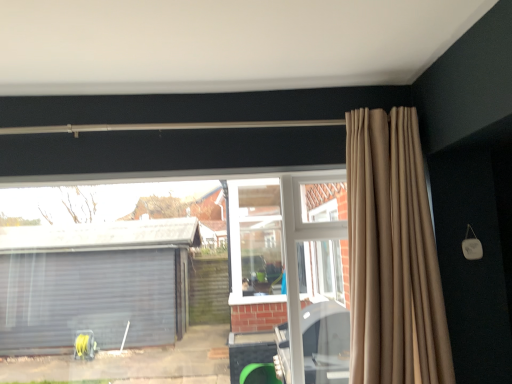
This screenshot has height=384, width=512. In order to click on transparent glass window at center in this screenshot , I will do `click(101, 283)`.

Image resolution: width=512 pixels, height=384 pixels. What do you see at coordinates (101, 283) in the screenshot? I see `transparent glass window at center` at bounding box center [101, 283].

In order to face transparent glass window at center, should I rotate leftwards or rightwards?

To face it directly, rotate left by 10.514 degrees.

In order to face beige fabric curtain at upper right, should I rotate leftwards or rightwards?

Rotate right and turn 17.223 degrees.

The width and height of the screenshot is (512, 384). What do you see at coordinates (393, 255) in the screenshot? I see `beige fabric curtain at upper right` at bounding box center [393, 255].

In order to click on beige fabric curtain at upper right in this screenshot , I will do `click(393, 255)`.

The height and width of the screenshot is (384, 512). Find the location of `transparent glass window at center`. transparent glass window at center is located at coordinates (101, 283).

Can you confirm if transparent glass window at center is positioned to the left of beige fabric curtain at upper right?

Indeed, transparent glass window at center is positioned on the left side of beige fabric curtain at upper right.

Which object is closer to the camera taking this photo, transparent glass window at center or beige fabric curtain at upper right?

beige fabric curtain at upper right is more forward.

Is point (71, 309) closer or farther from the camera than point (428, 265)?

Point (71, 309) is farther from the camera than point (428, 265).

From the image's perspective, is transparent glass window at center positioned above or below beige fabric curtain at upper right?

Based on their image positions, transparent glass window at center is located beneath beige fabric curtain at upper right.

From a real-world perspective, is transparent glass window at center over beige fabric curtain at upper right?

No, from a real-world perspective, transparent glass window at center is not over beige fabric curtain at upper right

Does transparent glass window at center have a greater width compared to beige fabric curtain at upper right?

No.

Does transparent glass window at center have a lesser height compared to beige fabric curtain at upper right?

Yes.

Which of these two, transparent glass window at center or beige fabric curtain at upper right, is bigger?

beige fabric curtain at upper right.

Is transparent glass window at center inside or outside of beige fabric curtain at upper right?

transparent glass window at center exists outside the volume of beige fabric curtain at upper right.

Is transparent glass window at center not near beige fabric curtain at upper right?

That's right, there is a large distance between transparent glass window at center and beige fabric curtain at upper right.

Based on the photo, is transparent glass window at center looking in the opposite direction of beige fabric curtain at upper right?

transparent glass window at center is not turned away from beige fabric curtain at upper right.

How distant is transparent glass window at center from beige fabric curtain at upper right?

The distance of transparent glass window at center from beige fabric curtain at upper right is 3.02 meters.

At what (x,y) coordinates should I click in order to perform the action: click on curtain above the transparent glass window at center (from a real-world perspective). Please return your answer as a coordinate pair (x, y). The height and width of the screenshot is (384, 512). Looking at the image, I should click on (393, 255).

Considering the relative positions of beige fabric curtain at upper right and transparent glass window at center in the image provided, is beige fabric curtain at upper right to the right of transparent glass window at center from the viewer's perspective?

Yes, beige fabric curtain at upper right is to the right of transparent glass window at center.

Which object is closer to the camera taking this photo, beige fabric curtain at upper right or transparent glass window at center?

beige fabric curtain at upper right is closer to the camera.

Is point (371, 221) farther from camera compared to point (295, 231)?

No, (371, 221) is in front of (295, 231).

From the image's perspective, is beige fabric curtain at upper right located above or below transparent glass window at center?

From the image's perspective, beige fabric curtain at upper right appears above transparent glass window at center.

From a real-world perspective, which is physically below, beige fabric curtain at upper right or transparent glass window at center?

transparent glass window at center.

From the picture: Can you confirm if beige fabric curtain at upper right is thinner than transparent glass window at center?

No.

Who is taller, beige fabric curtain at upper right or transparent glass window at center?

Standing taller between the two is beige fabric curtain at upper right.

Which of these two, beige fabric curtain at upper right or transparent glass window at center, is smaller?

transparent glass window at center.

Would you say beige fabric curtain at upper right is outside transparent glass window at center?

Yes, beige fabric curtain at upper right is not within transparent glass window at center.

Is there a large distance between beige fabric curtain at upper right and transparent glass window at center?

beige fabric curtain at upper right is positioned a significant distance from transparent glass window at center.

Is beige fabric curtain at upper right facing towards transparent glass window at center?

No, beige fabric curtain at upper right is not aimed at transparent glass window at center.

How many degrees apart are the facing directions of beige fabric curtain at upper right and transparent glass window at center?

The angle between the facing direction of beige fabric curtain at upper right and the facing direction of transparent glass window at center is 1.35 degrees.

How much distance is there between beige fabric curtain at upper right and transparent glass window at center?

A distance of 9.90 feet exists between beige fabric curtain at upper right and transparent glass window at center.

Where is `window lying on the left of beige fabric curtain at upper right`? window lying on the left of beige fabric curtain at upper right is located at coordinates (101, 283).

In order to click on window located on the left of beige fabric curtain at upper right in this screenshot , I will do `click(101, 283)`.

Where is `curtain that is on the right side of transparent glass window at center`? This screenshot has width=512, height=384. curtain that is on the right side of transparent glass window at center is located at coordinates (393, 255).